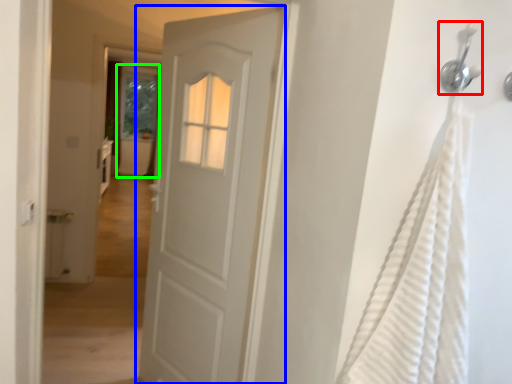
Question: Which object is positioned farthest from shower (highlighted by a red box)? Select from door (highlighted by a blue box) and screen door (highlighted by a green box).

Choices:
 (A) door
 (B) screen door

Answer: (B)